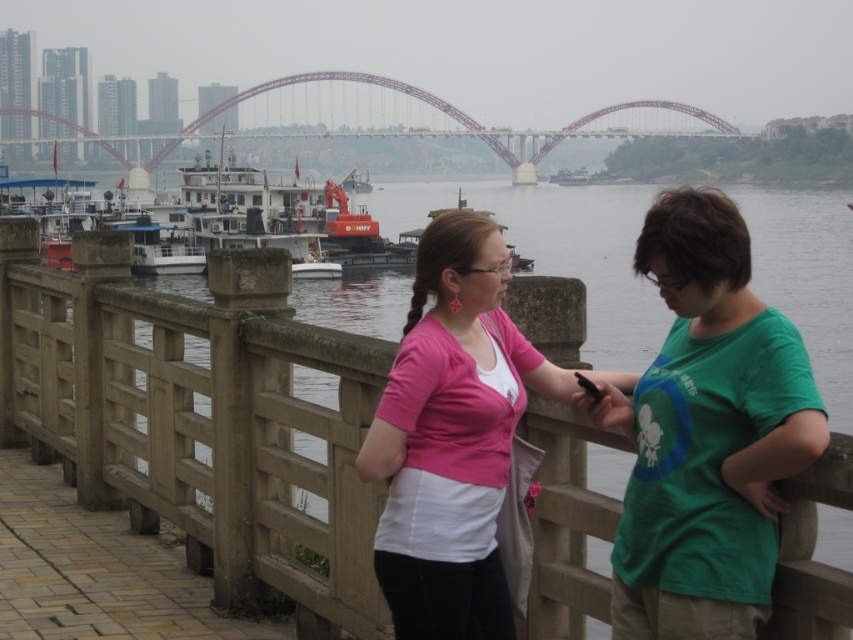
You are a painter planning to sketch the waterfront scene. You want to ensure the brown wooden rail at center and the metallic bridge at upper center are proportionally accurate. Which object should you draw narrower in your sketch?

The brown wooden rail at center should be drawn narrower in the sketch since it has a lesser width compared to the metallic bridge at upper center according to the description.